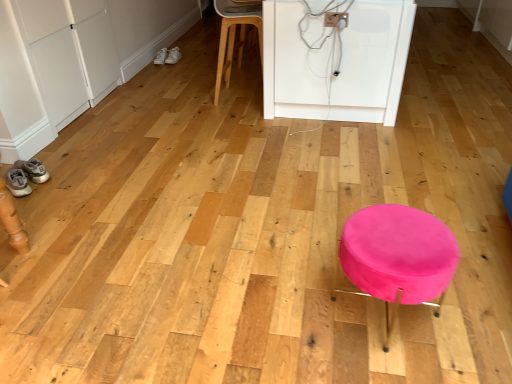
Question: From the image's perspective, is white leather sneakers at upper left, the 2th footwear positioned from the top, located above or below pink velvet stool at center?

Choices:
 (A) above
 (B) below

Answer: (A)

Question: In terms of width, does white leather sneakers at upper left, the second footwear in the back-to-front sequence, look wider or thinner when compared to pink velvet stool at center?

Choices:
 (A) thin
 (B) wide

Answer: (A)

Question: Based on their relative distances, which object is farther from the white plastic electric outlet at upper center?

Choices:
 (A) white leather sneakers at upper left, which ranks as the first footwear in right-to-left order
 (B) pink velvet stool at center
 (C) matte gray sneakers at lower left, positioned as the first footwear in front-to-back order
 (D) light wood stool at center
 (E) white leather sneakers at upper left, the second footwear from the bottom

Answer: (E)

Question: Estimate the real-world distances between objects in this image. Which object is farther from the white leather sneakers at upper left, placed as the 3th footwear when sorted from front to back?

Choices:
 (A) white leather sneakers at upper left, the 2th footwear positioned from the top
 (B) matte gray sneakers at lower left, positioned as the first footwear in front-to-back order
 (C) white plastic electric outlet at upper center
 (D) light wood stool at center
 (E) pink velvet stool at center

Answer: (E)